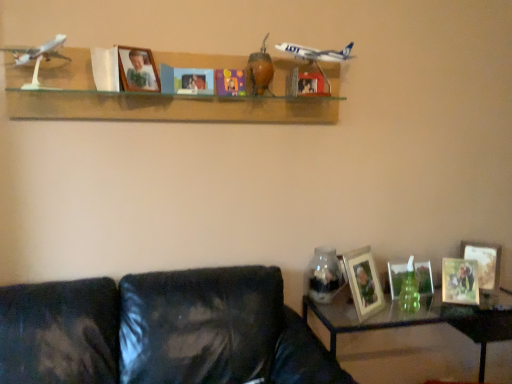
Question: Can you confirm if clear glass table at lower right is smaller than wooden photo frame at lower right, acting as the 1th picture frame starting from the right?

Choices:
 (A) no
 (B) yes

Answer: (A)

Question: Can you confirm if clear glass table at lower right is shorter than wooden photo frame at lower right, which ranks as the seventh picture frame in left-to-right order?

Choices:
 (A) yes
 (B) no

Answer: (B)

Question: Are clear glass table at lower right and wooden photo frame at lower right, which ranks as the seventh picture frame in left-to-right order, located far from each other?

Choices:
 (A) no
 (B) yes

Answer: (A)

Question: Is clear glass table at lower right to the left of wooden photo frame at lower right, acting as the 1th picture frame starting from the right, from the viewer's perspective?

Choices:
 (A) yes
 (B) no

Answer: (A)

Question: Is wooden photo frame at lower right, acting as the 1th picture frame starting from the right, completely or partially inside clear glass table at lower right?

Choices:
 (A) yes
 (B) no

Answer: (B)

Question: Is clear glass table at lower right with wooden photo frame at lower right, which ranks as the seventh picture frame in left-to-right order?

Choices:
 (A) no
 (B) yes

Answer: (A)

Question: Can you confirm if wooden photo frame at lower right, positioned as the 4th picture frame in right-to-left order, is shorter than wooden photo frame at upper center, the first picture frame from the left?

Choices:
 (A) no
 (B) yes

Answer: (A)

Question: Is wooden photo frame at lower right, positioned as the 4th picture frame in right-to-left order, touching wooden photo frame at upper center, the first picture frame from the left?

Choices:
 (A) no
 (B) yes

Answer: (A)

Question: Is the depth of wooden photo frame at lower right, placed as the fourth picture frame when sorted from left to right, less than that of wooden photo frame at upper center, the first picture frame from the left?

Choices:
 (A) yes
 (B) no

Answer: (B)

Question: Is wooden photo frame at lower right, positioned as the 4th picture frame in right-to-left order, at the right side of wooden photo frame at upper center, which is the 7th picture frame in right-to-left order?

Choices:
 (A) no
 (B) yes

Answer: (B)

Question: Can you confirm if wooden photo frame at lower right, placed as the fourth picture frame when sorted from left to right, is smaller than wooden photo frame at upper center, which is the 7th picture frame in right-to-left order?

Choices:
 (A) yes
 (B) no

Answer: (B)

Question: Is wooden photo frame at lower right, positioned as the 4th picture frame in right-to-left order, outside of wooden photo frame at upper center, the first picture frame from the left?

Choices:
 (A) no
 (B) yes

Answer: (B)

Question: Does matte wooden picture frame at center, the 2th picture frame when ordered from left to right, have a greater width compared to wooden photo frame at center, arranged as the fifth picture frame when viewed from the right?

Choices:
 (A) no
 (B) yes

Answer: (A)